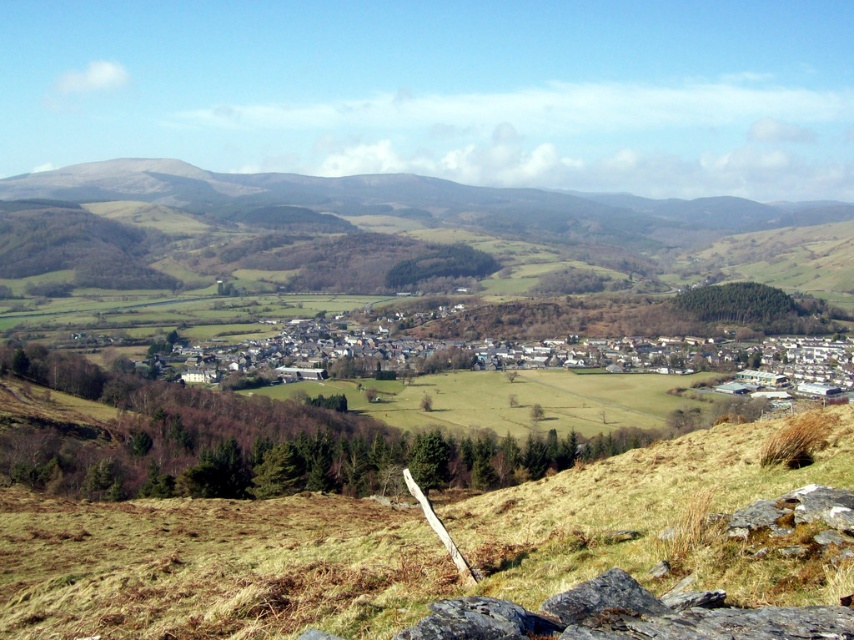
You are standing at the base of the slope where the dark gray rough rock at lower center is located. Looking up towards the green grassy hill at upper center, which direction should you walk to reach it?

You should walk to the right because the green grassy hill at upper center is positioned to the left of the dark gray rough rock at lower center, so from the rock, the hill is located to its left, which would mean you need to move in that direction to reach it.

You are a hiker standing on the brown dry grass at lower center and want to reach the green grassy hill at upper center. Which direction should you move to get there?

The green grassy hill at upper center is larger in size than the brown dry grass at lower center, so you should move upward towards the green grassy hill at upper center.